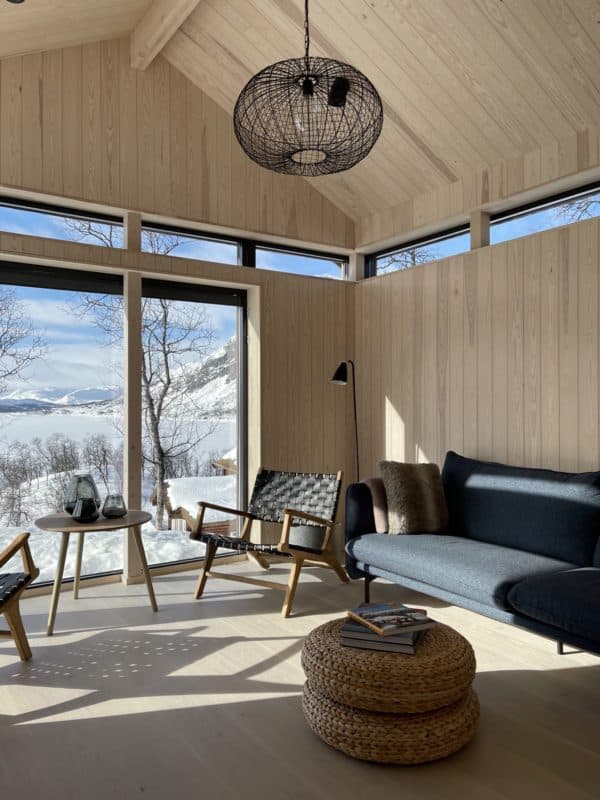
At what (x,y) coordinates should I click in order to perform the action: click on blanket. Please return your answer as a coordinate pair (x, y). Image resolution: width=600 pixels, height=800 pixels. Looking at the image, I should click on (380, 512).